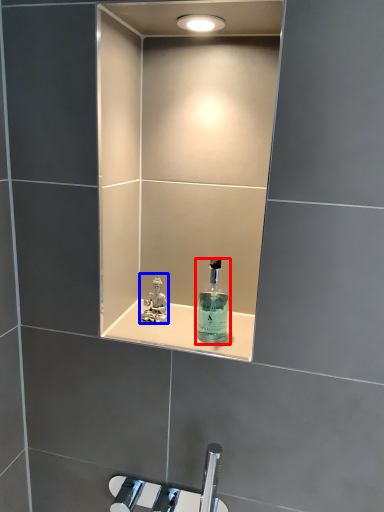
Question: Which object appears farthest to the camera in this image, bottle (highlighted by a red box) or perfume (highlighted by a blue box)?

Choices:
 (A) bottle
 (B) perfume

Answer: (B)